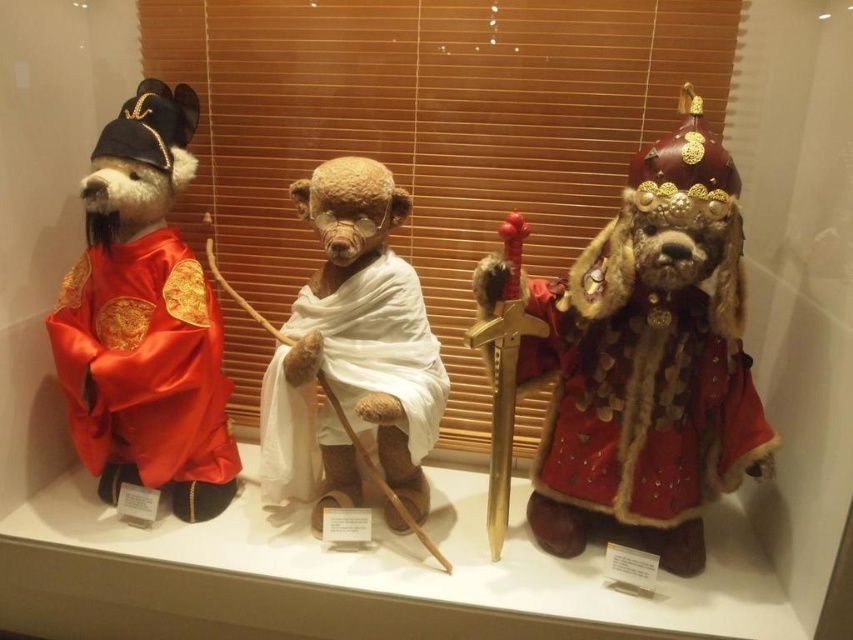
You are standing in front of the three teddy bears in the museum. There are two points marked in the image. Point A is at coordinates point [711,348] and Point B is at point [650,516]. Which point is closer to you?

Point A at coordinates point [711,348] is closer to the viewer than point B at point [650,516].

Consider the image. You are a museum visitor standing in front of the exhibit. You see the velvet red bear at center and the silky red robe at left. Which one is positioned more to the left side of the exhibit?

The silky red robe at left is positioned more to the left side of the exhibit than the velvet red bear at center.